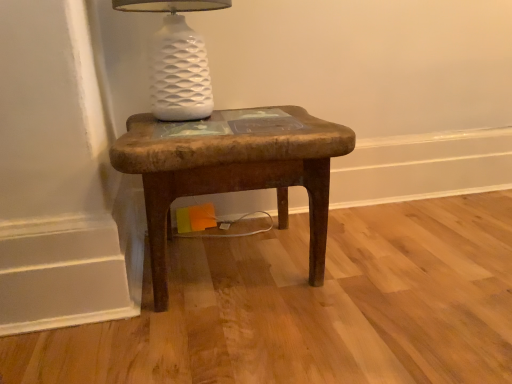
Question: From a real-world perspective, is rustic wood stool at center below white ceramic lamp at upper center?

Choices:
 (A) no
 (B) yes

Answer: (B)

Question: Is rustic wood stool at center beside white ceramic lamp at upper center?

Choices:
 (A) no
 (B) yes

Answer: (A)

Question: Can you confirm if rustic wood stool at center is bigger than white ceramic lamp at upper center?

Choices:
 (A) yes
 (B) no

Answer: (A)

Question: From a real-world perspective, does rustic wood stool at center stand above white ceramic lamp at upper center?

Choices:
 (A) yes
 (B) no

Answer: (B)

Question: Is rustic wood stool at center thinner than white ceramic lamp at upper center?

Choices:
 (A) yes
 (B) no

Answer: (B)

Question: Does rustic wood stool at center have a greater width compared to white ceramic lamp at upper center?

Choices:
 (A) no
 (B) yes

Answer: (B)

Question: Is white ceramic lamp at upper center looking in the opposite direction of rustic wood stool at center?

Choices:
 (A) no
 (B) yes

Answer: (A)

Question: Is white ceramic lamp at upper center oriented towards rustic wood stool at center?

Choices:
 (A) no
 (B) yes

Answer: (A)

Question: Is white ceramic lamp at upper center positioned behind rustic wood stool at center?

Choices:
 (A) yes
 (B) no

Answer: (A)

Question: Does white ceramic lamp at upper center appear on the left side of rustic wood stool at center?

Choices:
 (A) no
 (B) yes

Answer: (B)

Question: Is white ceramic lamp at upper center outside of rustic wood stool at center?

Choices:
 (A) no
 (B) yes

Answer: (B)

Question: Considering the relative sizes of white ceramic lamp at upper center and rustic wood stool at center in the image provided, is white ceramic lamp at upper center wider than rustic wood stool at center?

Choices:
 (A) no
 (B) yes

Answer: (A)

Question: In the image, is white ceramic lamp at upper center positioned in front of or behind rustic wood stool at center?

Choices:
 (A) front
 (B) behind

Answer: (B)